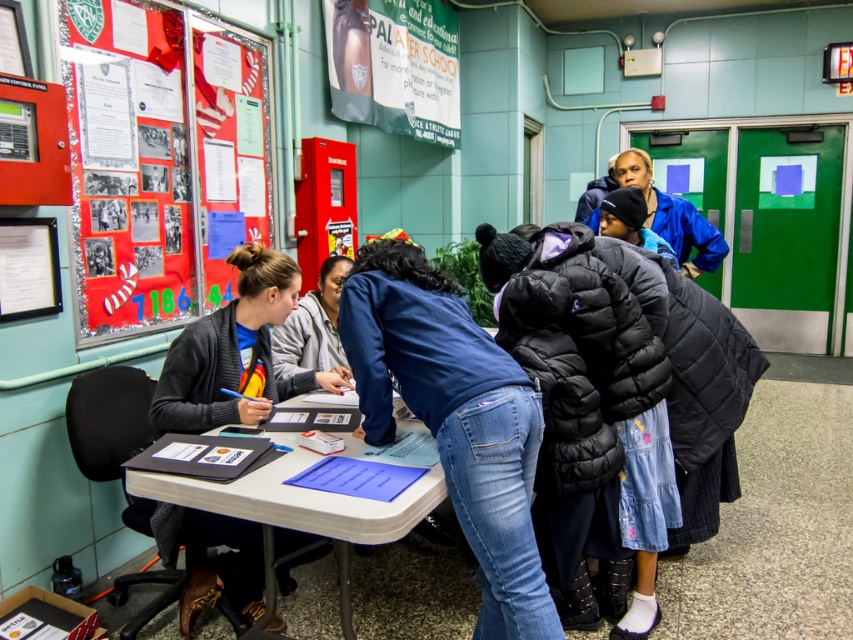
Does dark gray sweater at left come behind white plastic table at lower left?

Yes, it is behind white plastic table at lower left.

Does point (285, 541) come farther from viewer compared to point (242, 515)?

Yes.

The height and width of the screenshot is (640, 853). Describe the element at coordinates (234, 353) in the screenshot. I see `dark gray sweater at left` at that location.

Find the location of `dark gray sweater at left`. dark gray sweater at left is located at coordinates (234, 353).

Does blue denim jeans at center have a greater width compared to matte paper poster at upper center?

No.

Which is in front, point (421, 419) or point (416, 6)?

Point (421, 419) is more forward.

Where is `blue denim jeans at center`? The image size is (853, 640). blue denim jeans at center is located at coordinates coord(454,419).

At what (x,y) coordinates should I click in order to perform the action: click on blue denim jeans at center. Please return your answer as a coordinate pair (x, y). Image resolution: width=853 pixels, height=640 pixels. Looking at the image, I should click on (454, 419).

Between shiny metallic poster at upper left and blue denim jeans at center, which one appears on the left side from the viewer's perspective?

shiny metallic poster at upper left is more to the left.

Is point (109, 216) farther from camera compared to point (393, 433)?

That is True.

You are a GUI agent. You are given a task and a screenshot of the screen. Output one action in this format:
    pyautogui.click(x=<x>, y=<y>)
    Task: Click on the shiny metallic poster at upper left
    The width and height of the screenshot is (853, 640).
    Given the screenshot: What is the action you would take?
    pyautogui.click(x=161, y=163)